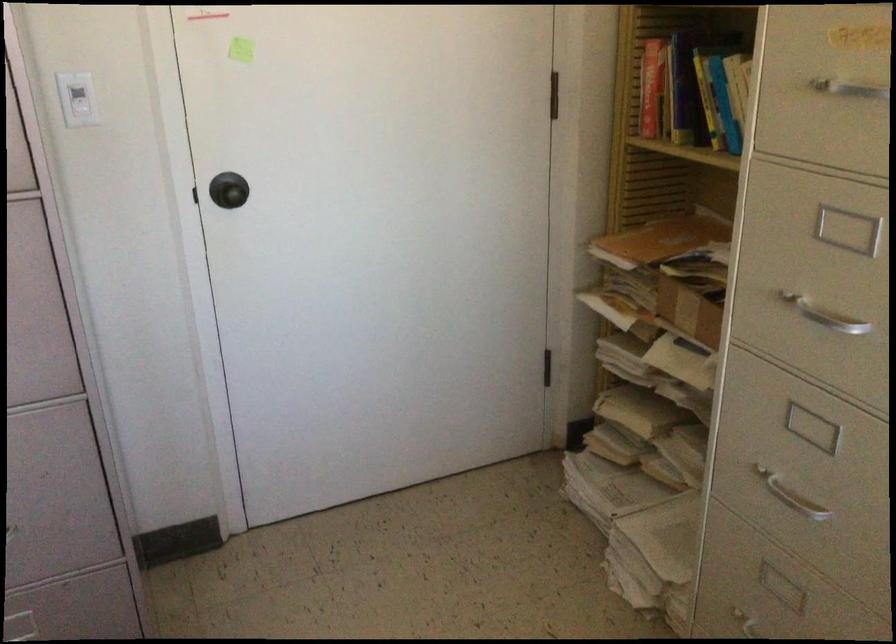
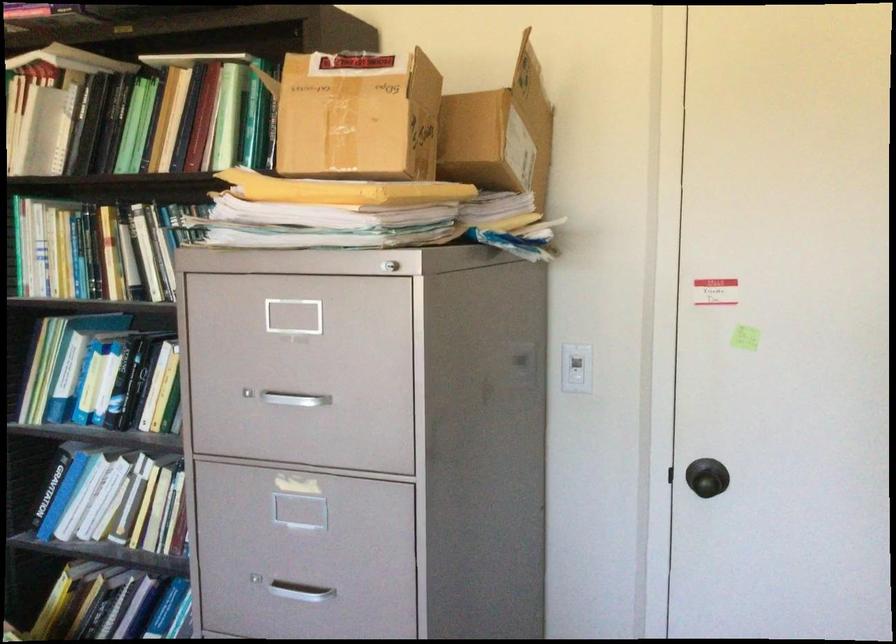
Question: The camera is either moving clockwise (left) or counter-clockwise (right) around the object. The first image is from the beginning of the video and the second image is from the end. Is the camera moving left or right when shooting the video?

Choices:
 (A) Left
 (B) Right

Answer: (B)